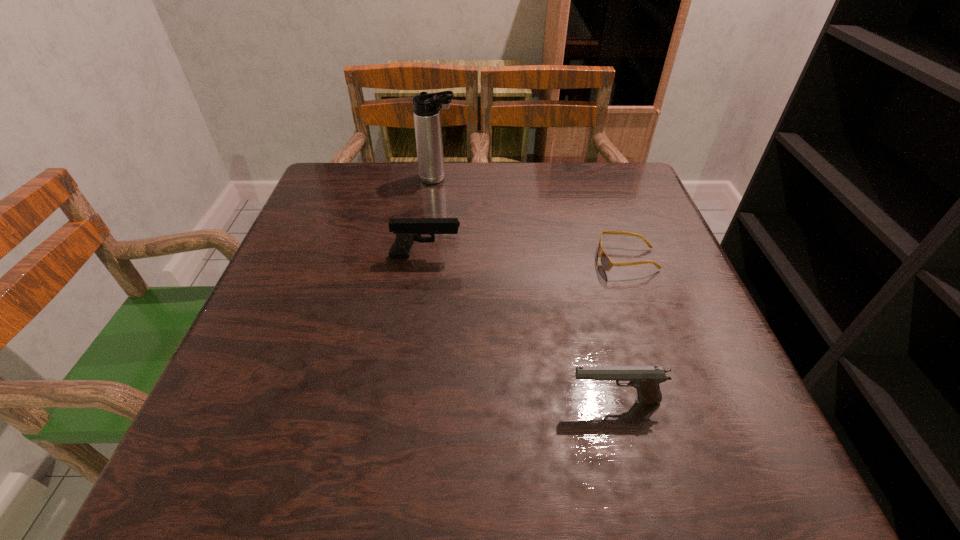
What are the coordinates of `free region at the right edge of the desktop` in the screenshot? It's located at (634, 217).

You are a GUI agent. You are given a task and a screenshot of the screen. Output one action in this format:
    pyautogui.click(x=<x>, y=<y>)
    Task: Click on the free space at the far left corner
    This screenshot has width=960, height=540.
    Given the screenshot: What is the action you would take?
    pyautogui.click(x=339, y=186)

Locate an element on the screen. This screenshot has width=960, height=540. vacant point at the far right corner is located at coordinates (614, 199).

At what (x,y) coordinates should I click in order to perform the action: click on vacant space at the near right corner of the desktop. Please return your answer as a coordinate pair (x, y). The height and width of the screenshot is (540, 960). Looking at the image, I should click on (703, 441).

In order to click on unoccupied position between the sunglasses and the thermos bottle in this screenshot , I will do 533,219.

The width and height of the screenshot is (960, 540). Identify the location of blank region between the sunglasses and the thermos bottle. (533, 219).

The image size is (960, 540). I want to click on free space between the nearest object and the left pistol, so click(520, 329).

You are a GUI agent. You are given a task and a screenshot of the screen. Output one action in this format:
    pyautogui.click(x=<x>, y=<y>)
    Task: Click on the free space between the nearest object and the shortest object
    
    Given the screenshot: What is the action you would take?
    pyautogui.click(x=621, y=330)

Find the location of a particular element. empty space that is in between the shortest object and the left pistol is located at coordinates (526, 258).

The width and height of the screenshot is (960, 540). Identify the location of vacant region between the farthest object and the farther pistol. tap(432, 218).